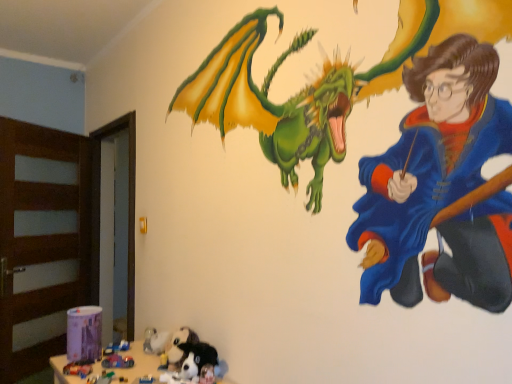
Question: Should I look upward or downward to see plastic toy car at lower left, which is the first toy from front to back?

Choices:
 (A) down
 (B) up

Answer: (A)

Question: Is soft plush dog at lower center, which is the second animal from front to back, at the left side of shiny plastic toy car at lower left, which is the second toy in front-to-back order?

Choices:
 (A) yes
 (B) no

Answer: (B)

Question: From the image's perspective, is soft plush dog at lower center, placed as the first animal when sorted from back to front, below shiny plastic toy car at lower left, which is the second toy in front-to-back order?

Choices:
 (A) no
 (B) yes

Answer: (A)

Question: Does soft plush dog at lower center, placed as the first animal when sorted from back to front, have a smaller size compared to shiny plastic toy car at lower left, the 2th toy when ordered from back to front?

Choices:
 (A) no
 (B) yes

Answer: (A)

Question: Does soft plush dog at lower center, placed as the first animal when sorted from back to front, appear on the right side of shiny plastic toy car at lower left, the 2th toy when ordered from back to front?

Choices:
 (A) no
 (B) yes

Answer: (B)

Question: Is soft plush dog at lower center, which is the second animal from front to back, positioned far away from shiny plastic toy car at lower left, which is the second toy in front-to-back order?

Choices:
 (A) no
 (B) yes

Answer: (A)

Question: From the image's perspective, is soft plush dog at lower center, which is the second animal from front to back, over shiny plastic toy car at lower left, the 2th toy when ordered from back to front?

Choices:
 (A) no
 (B) yes

Answer: (B)

Question: Would you say soft plush dog at lower center, marked as the first animal in a front-to-back arrangement, contains shiny plastic toy car at lower left, which is the second toy in front-to-back order?

Choices:
 (A) no
 (B) yes

Answer: (A)

Question: Considering the relative sizes of soft plush dog at lower center, the second animal when ordered from back to front, and shiny plastic toy car at lower left, which is the second toy in front-to-back order, in the image provided, is soft plush dog at lower center, the second animal when ordered from back to front, taller than shiny plastic toy car at lower left, which is the second toy in front-to-back order,?

Choices:
 (A) no
 (B) yes

Answer: (B)

Question: Can you confirm if soft plush dog at lower center, marked as the first animal in a front-to-back arrangement, is thinner than shiny plastic toy car at lower left, the 2th toy when ordered from back to front?

Choices:
 (A) no
 (B) yes

Answer: (A)

Question: Is soft plush dog at lower center, the second animal when ordered from back to front, not near shiny plastic toy car at lower left, which is the second toy in front-to-back order?

Choices:
 (A) yes
 (B) no

Answer: (B)

Question: Is soft plush dog at lower center, the second animal when ordered from back to front, shorter than shiny plastic toy car at lower left, the 2th toy when ordered from back to front?

Choices:
 (A) yes
 (B) no

Answer: (B)

Question: Does soft plush dog at lower center, marked as the first animal in a front-to-back arrangement, have a larger size compared to shiny plastic toy car at lower left, which is the second toy in front-to-back order?

Choices:
 (A) yes
 (B) no

Answer: (A)

Question: Is plastic toy car at lower left, which ranks as the 3th toy in front-to-back order, not close to shiny plastic toy car at lower left, the 2th toy when ordered from back to front?

Choices:
 (A) yes
 (B) no

Answer: (B)